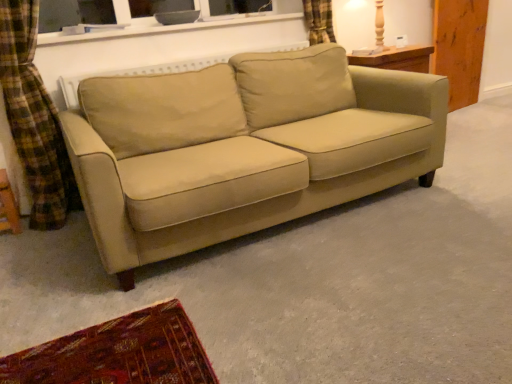
The width and height of the screenshot is (512, 384). I want to click on space that is in front of beige fabric couch at center, so click(291, 299).